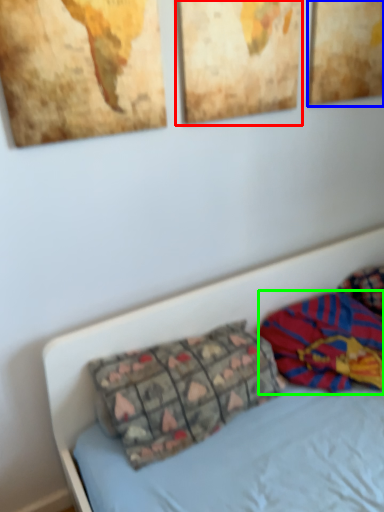
Question: Which is nearer to the picture frame (highlighted by a red box)? picture frame (highlighted by a blue box) or material (highlighted by a green box).

Choices:
 (A) picture frame
 (B) material

Answer: (A)